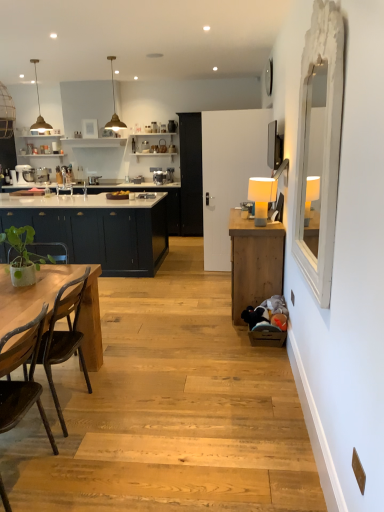
Question: Does point (236, 281) appear closer or farther from the camera than point (19, 276)?

Choices:
 (A) farther
 (B) closer

Answer: (A)

Question: Which is correct: wooden cabinet at right, acting as the second cabinetry starting from the left, is inside green matte plant at left, or outside of it?

Choices:
 (A) inside
 (B) outside

Answer: (B)

Question: Which is farther from the green matte plant at left?

Choices:
 (A) matte white sink at center
 (B) dark brown wooden chair at lower left
 (C) gold textured pendant light at upper left, acting as the 1th lamp starting from the back
 (D) matte dark blue cabinets at left, the 2th cabinetry positioned from the right
 (E) natural wood table at left

Answer: (C)

Question: Based on their relative distances, which object is farther from the gold metallic pendant light at upper center, which appears as the second lamp when viewed from the right?

Choices:
 (A) gold textured pendant light at upper left, acting as the 1th lamp starting from the top
 (B) white wooden mirror at right
 (C) matte dark blue cabinets at left, the 2th cabinetry positioned from the right
 (D) dark brown wooden chair at lower left
 (E) green matte plant at left

Answer: (D)